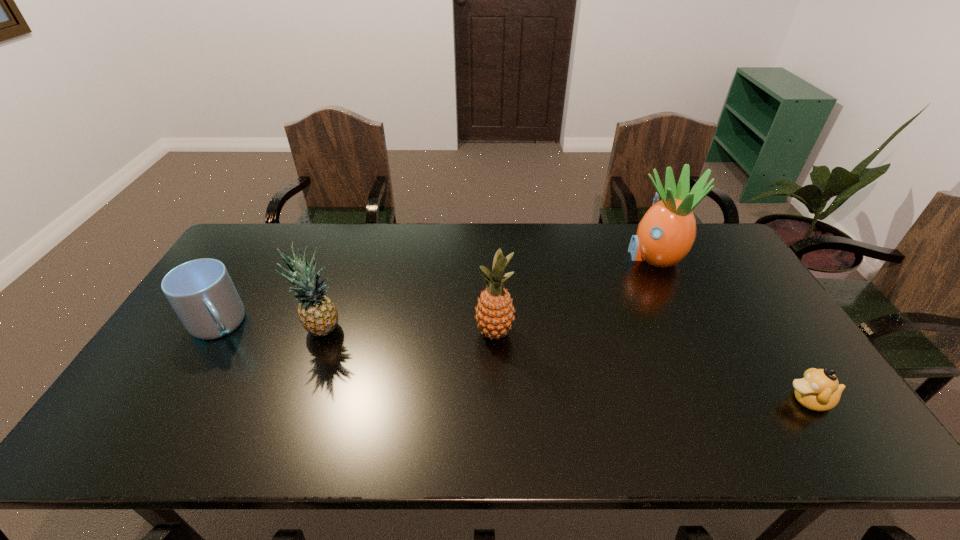
Where is `free region located 0.330m at the entrance of the second object from right to left`? free region located 0.330m at the entrance of the second object from right to left is located at coordinates (528, 255).

This screenshot has width=960, height=540. In order to click on vacant point located on the front of the third object from left to right in this screenshot , I will do `click(496, 401)`.

What are the coordinates of `vacant space located on the left of the second object from left to right` in the screenshot? It's located at (250, 331).

This screenshot has width=960, height=540. In order to click on free space located on the back of the mug in this screenshot , I will do `click(255, 263)`.

Image resolution: width=960 pixels, height=540 pixels. Identify the location of blank space located on the face of the shortest object. (685, 400).

What are the coordinates of `free space located 0.100m on the face of the shortest object` in the screenshot? It's located at point(743,400).

Image resolution: width=960 pixels, height=540 pixels. Find the location of `free space located 0.350m on the face of the shortest object`. free space located 0.350m on the face of the shortest object is located at coordinates (640, 400).

Locate an element on the screen. object that is positioned at the far edge is located at coordinates (665, 235).

This screenshot has width=960, height=540. I want to click on object located in the left edge section of the desktop, so click(201, 292).

Find the location of a particular element. object situated at the right edge is located at coordinates coord(819,390).